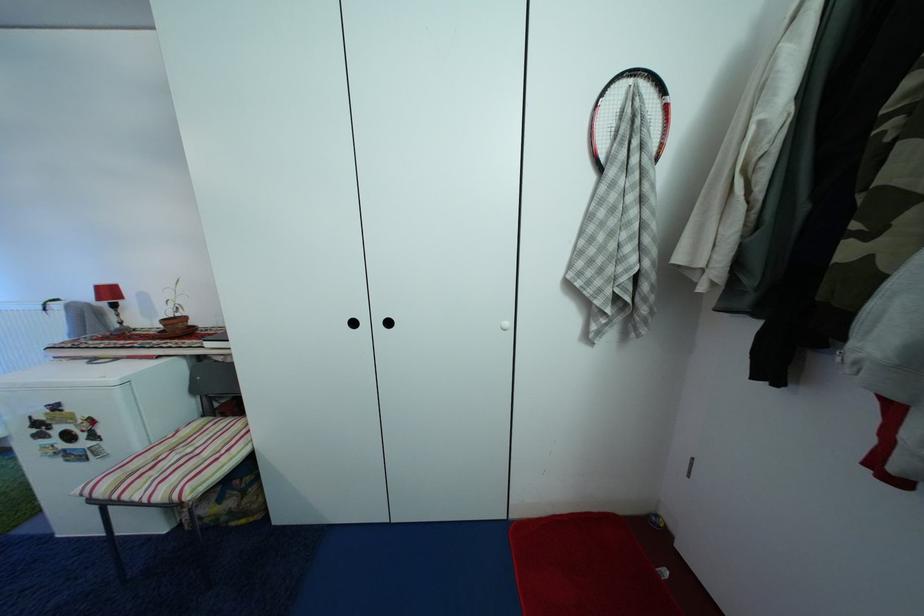
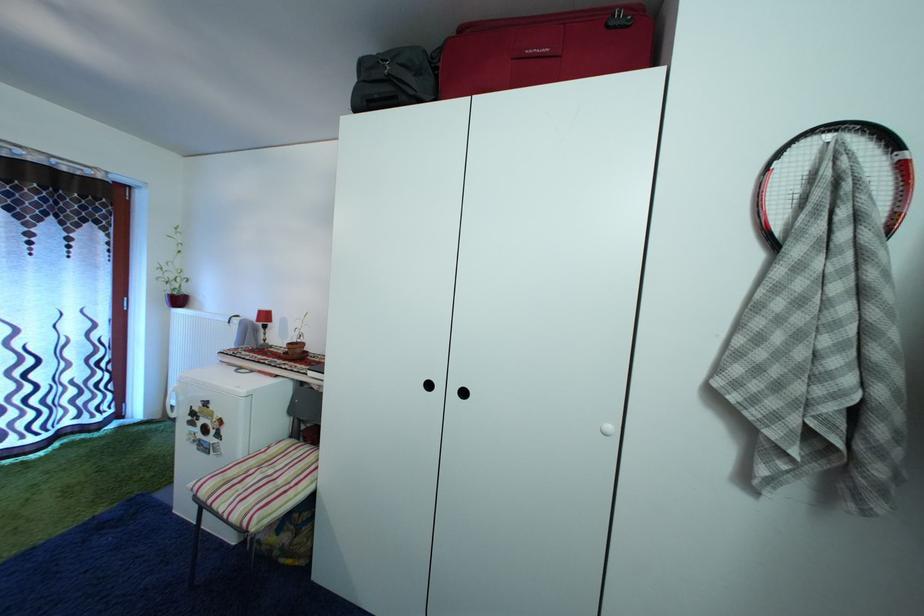
Which direction would the cameraman need to move to produce the second image?

The cameraman moved toward left, forward.